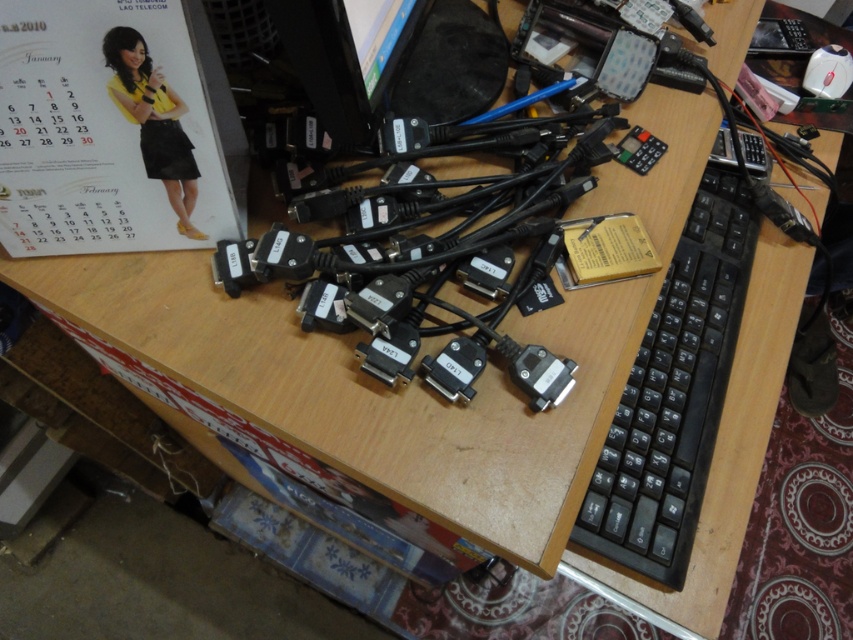
You are a technician trying to reach the black plastic keyboard at right from your current position. The minimum distance you need to move forward to touch it is 24.57 inches. Is this distance sufficient to reach it without moving your chair?

The black plastic keyboard at right is 24.57 inches away from the camera. Therefore, moving forward exactly 24.57 inches would allow you to touch it without needing to move your chair.

You are organizing the desk and need to place a new item between the matte paper calendar at upper left and the black plastic monitor at upper center. Is there enough vertical space between them to fit a 2cm thick item?

The matte paper calendar at upper left is located below the black plastic monitor at upper center, so there is vertical space between them. Since the item is only 2cm thick, it should fit between them vertically.

You are a technician trying to locate a specific point on the desk. The point is labeled as point (152, 202). Given that the camera is positioned at a standard height, can you estimate whether this point is closer to the edge of the desk or near the center?

The point (152, 202) is 21.67 inches from the camera. Since the camera is at a standard height, this distance suggests the point is closer to the center of the desk rather than the edge.